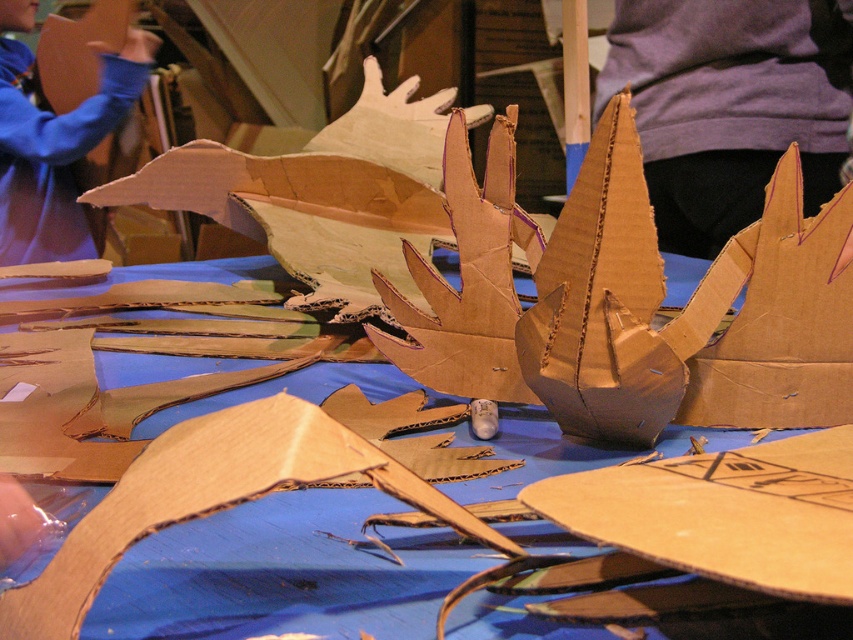
Question: Can you confirm if cardboard pieces at center is thinner than matte blue sweatshirt at upper left?

Choices:
 (A) no
 (B) yes

Answer: (A)

Question: Which point appears farthest from the camera in this image?

Choices:
 (A) (728, 348)
 (B) (4, 177)
 (C) (207, 388)

Answer: (B)

Question: Is cardboard pieces at center positioned behind matte blue sweatshirt at upper left?

Choices:
 (A) no
 (B) yes

Answer: (A)

Question: Which object appears closest to the camera in this image?

Choices:
 (A) matte blue sweatshirt at upper left
 (B) cardboard pieces at center
 (C) cardboard at center

Answer: (B)

Question: Does cardboard at center appear under matte blue sweatshirt at upper left?

Choices:
 (A) yes
 (B) no

Answer: (A)

Question: Which of the following is the farthest from the observer?

Choices:
 (A) (755, 408)
 (B) (51, 346)

Answer: (B)